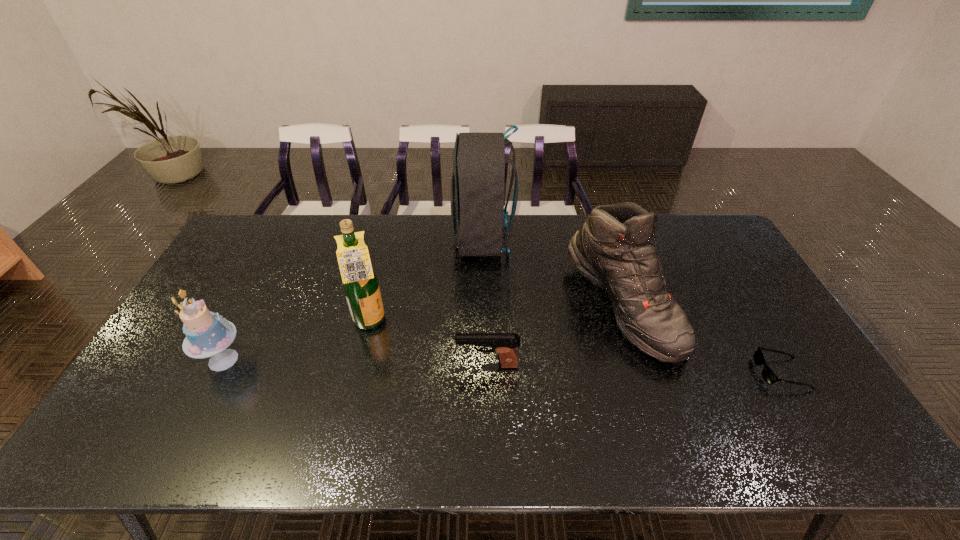
At what (x,y) coordinates should I click in order to perform the action: click on empty space that is in between the shortest object and the pistol. Please return your answer as a coordinate pair (x, y). Image resolution: width=960 pixels, height=540 pixels. Looking at the image, I should click on (634, 369).

Identify the location of free space between the third shortest object and the liquor. The width and height of the screenshot is (960, 540). (297, 341).

Find the location of a particular element. vacant point located between the fifth tallest object and the ski boot is located at coordinates (555, 335).

Find the location of a particular element. The height and width of the screenshot is (540, 960). unoccupied position between the ski boot and the rightmost object is located at coordinates (702, 339).

Image resolution: width=960 pixels, height=540 pixels. Find the location of `vacant space that is in between the backpack and the fifth tallest object`. vacant space that is in between the backpack and the fifth tallest object is located at coordinates (485, 302).

Identify which object is the closest to the shortest object. Please provide its 2D coordinates. Your answer should be formatted as a tuple, i.e. [(x, y)], where the tuple contains the x and y coordinates of a point satisfying the conditions above.

[(614, 249)]

Where is `object that can be found as the closest to the fourth tallest object`? This screenshot has width=960, height=540. object that can be found as the closest to the fourth tallest object is located at coordinates (360, 283).

The width and height of the screenshot is (960, 540). I want to click on free point that satisfies the following two spatial constraints: 1. on the front-facing side of the tallest object; 2. on the right side of the fifth object from left to right, so click(x=483, y=305).